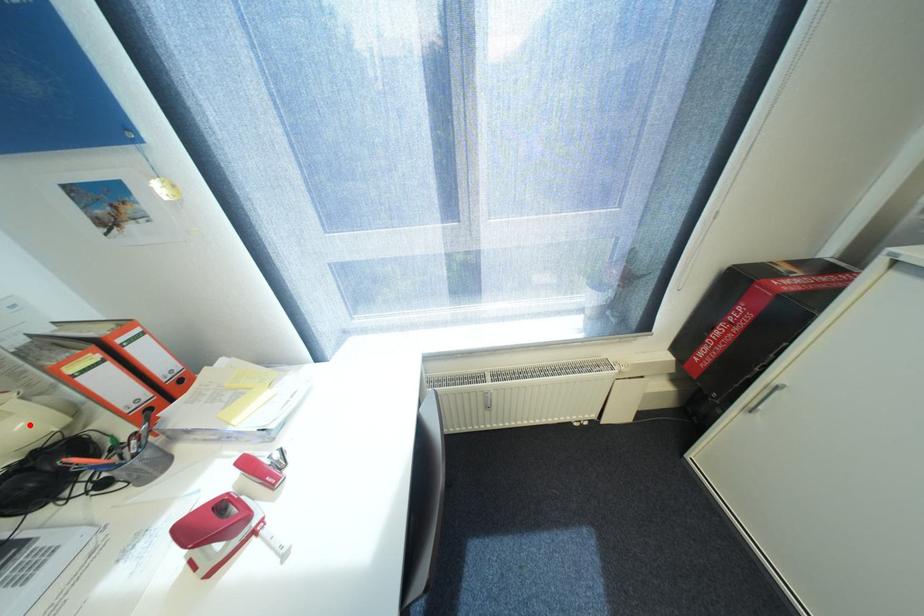
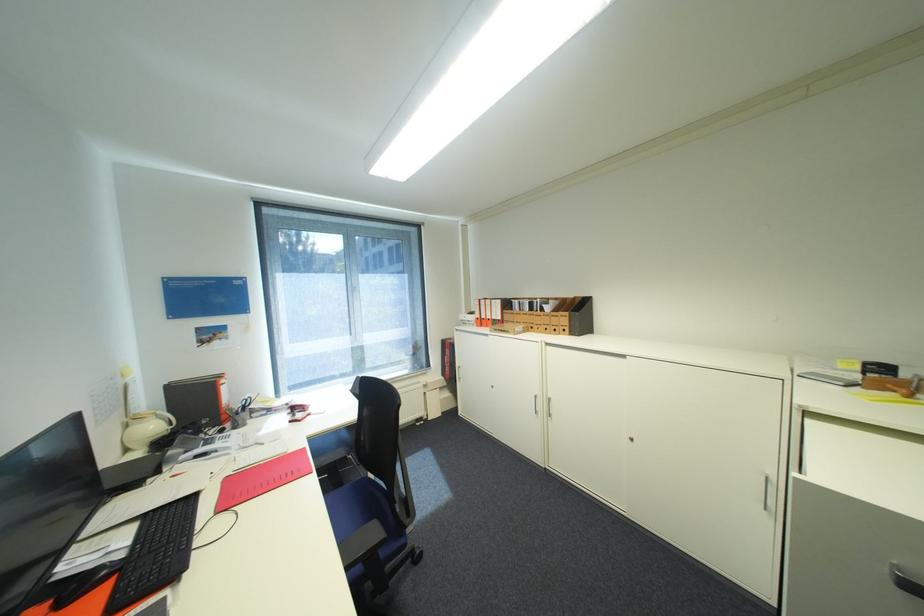
Question: I am providing you with two images of the same scene from different viewpoints. Image1 has a red point marked. In image2, the corresponding 3D location appears at what relative position? Reply with the corresponding letter.

Choices:
 (A) Closer
 (B) Farther

Answer: (A)